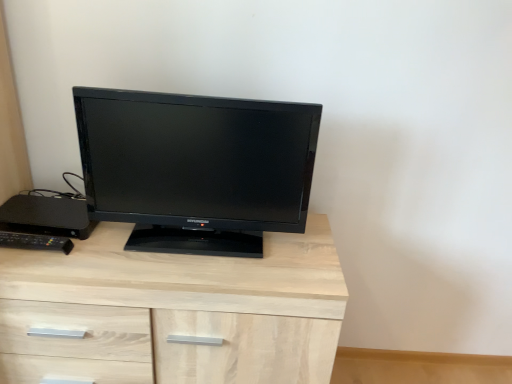
Describe the element at coordinates (174, 311) in the screenshot. I see `light wood chest of drawers at center` at that location.

The height and width of the screenshot is (384, 512). I want to click on black plastic desktop at left, the second desktop in the front-to-back sequence, so click(46, 216).

What do you see at coordinates (46, 216) in the screenshot?
I see `black plastic desktop at left, acting as the first desktop starting from the back` at bounding box center [46, 216].

Locate an element on the screen. The height and width of the screenshot is (384, 512). black plastic remote control at left, which is the first desktop from front to back is located at coordinates (35, 242).

Is black plastic remote control at left, which is the first desktop from front to back, turned away from black plastic desktop at left, the second desktop in the front-to-back sequence?

Yes.

Is black plastic desktop at left, acting as the first desktop starting from the back, completely or partially inside black plastic remote control at left, which is the first desktop from front to back?

No, black plastic desktop at left, acting as the first desktop starting from the back, is not a part of black plastic remote control at left, which is the first desktop from front to back.

From a real-world perspective, who is located lower, black plastic remote control at left, which is counted as the 2th desktop, starting from the back, or black plastic desktop at left, acting as the first desktop starting from the back?

In real-world perspective, black plastic desktop at left, acting as the first desktop starting from the back, is lower.

Considering their positions, is black plastic remote control at left, which is the first desktop from front to back, located in front of or behind black plastic desktop at left, acting as the first desktop starting from the back?

black plastic remote control at left, which is the first desktop from front to back, is in front of black plastic desktop at left, acting as the first desktop starting from the back.

Based on the photo, how different are the orientations of black glossy monitor at center and black plastic desktop at left, the second desktop in the front-to-back sequence, in degrees?

black glossy monitor at center and black plastic desktop at left, the second desktop in the front-to-back sequence, are facing 1.35 degrees away from each other.

Between black glossy monitor at center and black plastic desktop at left, acting as the first desktop starting from the back, which one appears on the left side from the viewer's perspective?

black plastic desktop at left, acting as the first desktop starting from the back.

From the picture: Is black glossy monitor at center positioned far away from black plastic desktop at left, acting as the first desktop starting from the back?

No.

How distant is black plastic remote control at left, which is the first desktop from front to back, from black glossy monitor at center?

The distance of black plastic remote control at left, which is the first desktop from front to back, from black glossy monitor at center is 15.77 inches.

Considering the relative sizes of black plastic remote control at left, which is counted as the 2th desktop, starting from the back, and black glossy monitor at center in the image provided, is black plastic remote control at left, which is counted as the 2th desktop, starting from the back, bigger than black glossy monitor at center?

Incorrect, black plastic remote control at left, which is counted as the 2th desktop, starting from the back, is not larger than black glossy monitor at center.

Visually, is black plastic remote control at left, which is counted as the 2th desktop, starting from the back, positioned to the left or to the right of black glossy monitor at center?

From the image, it's evident that black plastic remote control at left, which is counted as the 2th desktop, starting from the back, is to the left of black glossy monitor at center.

From the image's perspective, which one is positioned higher, black plastic remote control at left, which is counted as the 2th desktop, starting from the back, or black glossy monitor at center?

black glossy monitor at center.

Considering the relative positions of black plastic desktop at left, acting as the first desktop starting from the back, and black plastic remote control at left, which is counted as the 2th desktop, starting from the back, in the image provided, is black plastic desktop at left, acting as the first desktop starting from the back, to the left of black plastic remote control at left, which is counted as the 2th desktop, starting from the back, from the viewer's perspective?

Yes.

From a real-world perspective, between black plastic desktop at left, the second desktop in the front-to-back sequence, and black plastic remote control at left, which is counted as the 2th desktop, starting from the back, who is vertically lower?

In real-world perspective, black plastic desktop at left, the second desktop in the front-to-back sequence, is lower.

Is black plastic desktop at left, acting as the first desktop starting from the back, shorter than black plastic remote control at left, which is the first desktop from front to back?

Yes.

From the picture: Which is correct: black plastic desktop at left, the second desktop in the front-to-back sequence, is inside black plastic remote control at left, which is counted as the 2th desktop, starting from the back, or outside of it?

black plastic desktop at left, the second desktop in the front-to-back sequence, is located beyond the bounds of black plastic remote control at left, which is counted as the 2th desktop, starting from the back.

How many degrees apart are the facing directions of light wood chest of drawers at center and black plastic desktop at left, the second desktop in the front-to-back sequence?

The angular difference between light wood chest of drawers at center and black plastic desktop at left, the second desktop in the front-to-back sequence, is 3.66 degrees.

Considering the relative sizes of light wood chest of drawers at center and black plastic desktop at left, acting as the first desktop starting from the back, in the image provided, is light wood chest of drawers at center taller than black plastic desktop at left, acting as the first desktop starting from the back,?

Indeed, light wood chest of drawers at center has a greater height compared to black plastic desktop at left, acting as the first desktop starting from the back.

From the picture: Considering the sizes of light wood chest of drawers at center and black plastic desktop at left, acting as the first desktop starting from the back, in the image, is light wood chest of drawers at center wider or thinner than black plastic desktop at left, acting as the first desktop starting from the back,?

In the image, light wood chest of drawers at center appears to be wider than black plastic desktop at left, acting as the first desktop starting from the back.

Considering the points (25, 195) and (134, 280), which point is in front, point (25, 195) or point (134, 280)?

Point (134, 280)

Is black plastic desktop at left, acting as the first desktop starting from the back, not within light wood chest of drawers at center?

No.

Is black plastic desktop at left, the second desktop in the front-to-back sequence, taller than light wood chest of drawers at center?

No.

From a real-world perspective, who is located lower, black plastic desktop at left, the second desktop in the front-to-back sequence, or light wood chest of drawers at center?

light wood chest of drawers at center, from a real-world perspective.

Which object is further away from the camera taking this photo, light wood chest of drawers at center or black plastic remote control at left, which is counted as the 2th desktop, starting from the back?

black plastic remote control at left, which is counted as the 2th desktop, starting from the back, is further from the camera.

Is light wood chest of drawers at center located outside black plastic remote control at left, which is counted as the 2th desktop, starting from the back?

That's correct, light wood chest of drawers at center is outside of black plastic remote control at left, which is counted as the 2th desktop, starting from the back.

Are light wood chest of drawers at center and black plastic remote control at left, which is counted as the 2th desktop, starting from the back, located far from each other?

They are positioned close to each other.

Find the location of a particular element. This screenshot has width=512, height=384. the chest of drawers beneath the black plastic remote control at left, which is the first desktop from front to back (from a real-world perspective) is located at coordinates (174, 311).

You are a GUI agent. You are given a task and a screenshot of the screen. Output one action in this format:
    pyautogui.click(x=<x>, y=<y>)
    Task: Click on the desktop in front of the black plastic desktop at left, the second desktop in the front-to-back sequence
    The width and height of the screenshot is (512, 384).
    Given the screenshot: What is the action you would take?
    pyautogui.click(x=35, y=242)

Find the location of `desktop that is the 2nd one when counting backward from the black glossy monitor at center`. desktop that is the 2nd one when counting backward from the black glossy monitor at center is located at coordinates (46, 216).

Looking at the image, which one is located further to black plastic remote control at left, which is the first desktop from front to back, black plastic desktop at left, acting as the first desktop starting from the back, or light wood chest of drawers at center?

Among the two, light wood chest of drawers at center is located further to black plastic remote control at left, which is the first desktop from front to back.

From the image, which object appears to be farther from black plastic remote control at left, which is the first desktop from front to back, light wood chest of drawers at center or black plastic desktop at left, acting as the first desktop starting from the back?

light wood chest of drawers at center.

Based on the photo, estimate the real-world distances between objects in this image. Which object is further from black plastic remote control at left, which is counted as the 2th desktop, starting from the back, black glossy monitor at center or black plastic desktop at left, the second desktop in the front-to-back sequence?

black glossy monitor at center is positioned further to the anchor black plastic remote control at left, which is counted as the 2th desktop, starting from the back.

Looking at the image, which one is located closer to black plastic desktop at left, the second desktop in the front-to-back sequence, black plastic remote control at left, which is counted as the 2th desktop, starting from the back, or black glossy monitor at center?

black plastic remote control at left, which is counted as the 2th desktop, starting from the back, lies closer to black plastic desktop at left, the second desktop in the front-to-back sequence, than the other object.

Considering their positions, is black plastic desktop at left, the second desktop in the front-to-back sequence, positioned further to light wood chest of drawers at center than black glossy monitor at center?

black plastic desktop at left, the second desktop in the front-to-back sequence, lies further to light wood chest of drawers at center than the other object.

Considering their positions, is black plastic desktop at left, the second desktop in the front-to-back sequence, positioned closer to light wood chest of drawers at center than black plastic remote control at left, which is the first desktop from front to back?

black plastic desktop at left, the second desktop in the front-to-back sequence, is closer to light wood chest of drawers at center.

Consider the image. When comparing their distances from black plastic desktop at left, acting as the first desktop starting from the back, does light wood chest of drawers at center or black glossy monitor at center seem closer?

black glossy monitor at center is positioned closer to the anchor black plastic desktop at left, acting as the first desktop starting from the back.

Looking at the image, which one is located further to black glossy monitor at center, black plastic desktop at left, acting as the first desktop starting from the back, or light wood chest of drawers at center?

Among the two, black plastic desktop at left, acting as the first desktop starting from the back, is located further to black glossy monitor at center.

Where is `desktop between black plastic desktop at left, acting as the first desktop starting from the back, and black glossy monitor at center from left to right`? The image size is (512, 384). desktop between black plastic desktop at left, acting as the first desktop starting from the back, and black glossy monitor at center from left to right is located at coordinates point(35,242).

Identify the location of desktop that lies between black plastic desktop at left, acting as the first desktop starting from the back, and light wood chest of drawers at center from top to bottom. Image resolution: width=512 pixels, height=384 pixels. (35, 242).